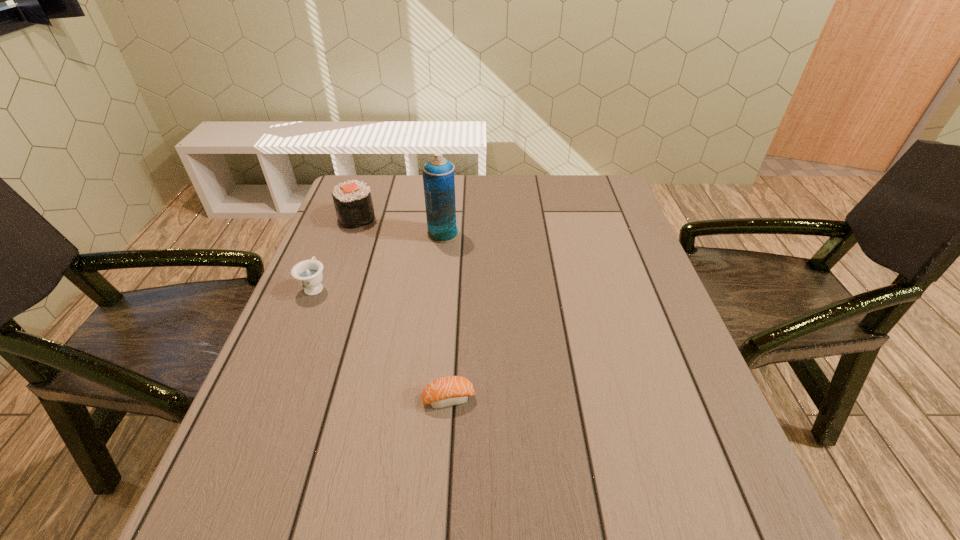
In the image, there is a desktop. Where is `vacant space at the right edge`? The width and height of the screenshot is (960, 540). vacant space at the right edge is located at coordinates (712, 406).

At what (x,y) coordinates should I click in order to perform the action: click on vacant space at the near left corner of the desktop. Please return your answer as a coordinate pair (x, y). This screenshot has height=540, width=960. Looking at the image, I should click on (220, 538).

This screenshot has height=540, width=960. Find the location of `free space at the far right corner of the desktop`. free space at the far right corner of the desktop is located at coordinates (577, 212).

Find the location of a particular element. The height and width of the screenshot is (540, 960). free spot at the near right corner of the desktop is located at coordinates (727, 518).

The width and height of the screenshot is (960, 540). I want to click on free point between the taller sushi and the third farthest object, so click(x=336, y=252).

The width and height of the screenshot is (960, 540). Find the location of `vacant space that is in between the teacup and the tallest object`. vacant space that is in between the teacup and the tallest object is located at coordinates (379, 260).

Find the location of `free space between the nearest object and the farther sushi`. free space between the nearest object and the farther sushi is located at coordinates (403, 308).

Find the location of a particular element. free space between the left sushi and the third tallest object is located at coordinates (336, 252).

What are the coordinates of `free spot between the second shortest object and the left sushi` in the screenshot? It's located at (336, 252).

Identify the location of vacant region between the tallest object and the nearer sushi. (446, 316).